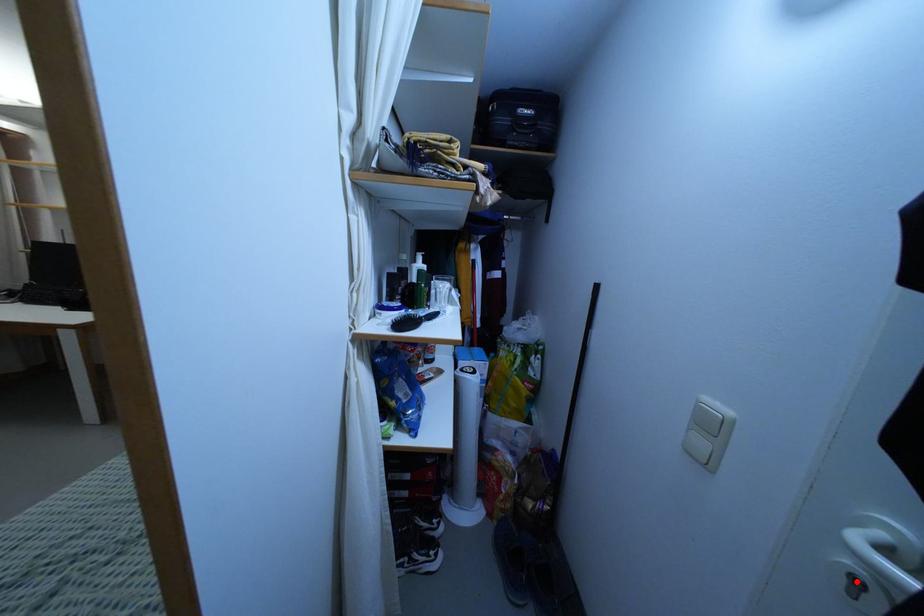
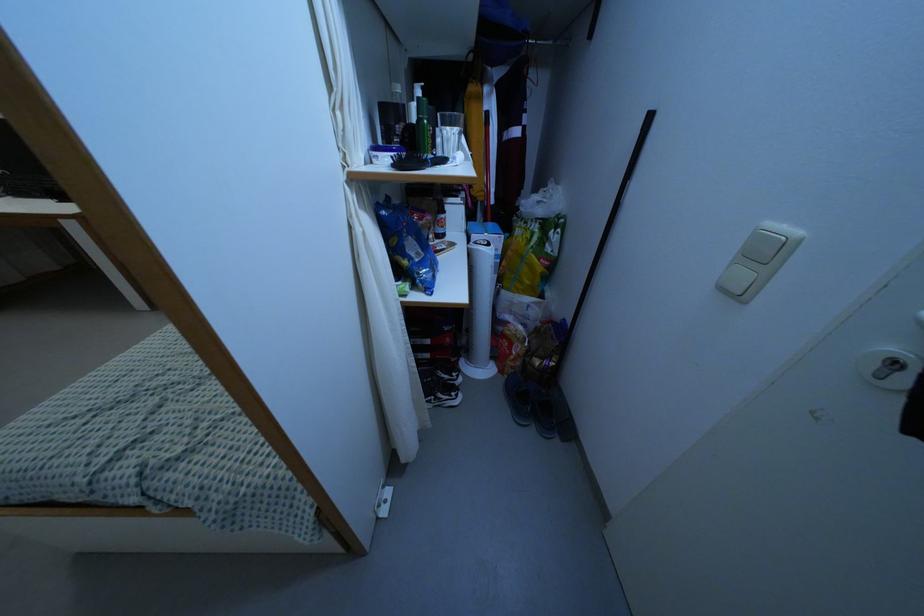
The point at the highlighted location is marked in the first image. Where is the corresponding point in the second image?

(894, 363)